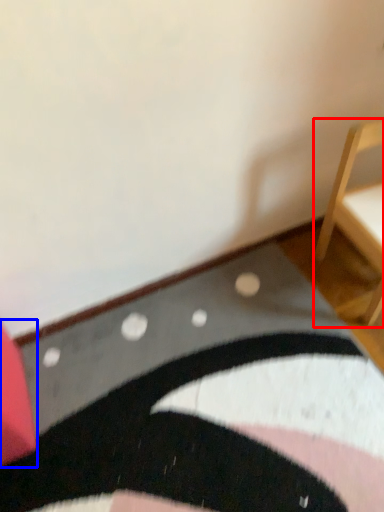
Question: Among these objects, which one is farthest to the camera, furniture (highlighted by a red box) or furniture (highlighted by a blue box)?

Choices:
 (A) furniture
 (B) furniture

Answer: (A)